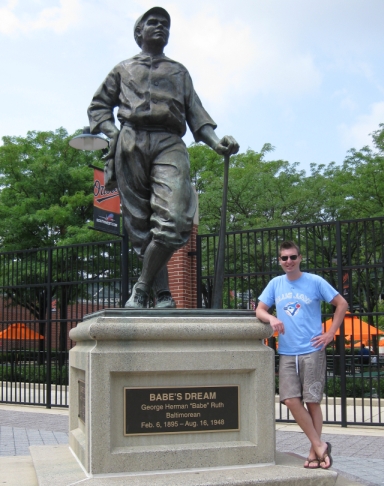
Identify the location of statue. This screenshot has width=384, height=486. (172, 212).